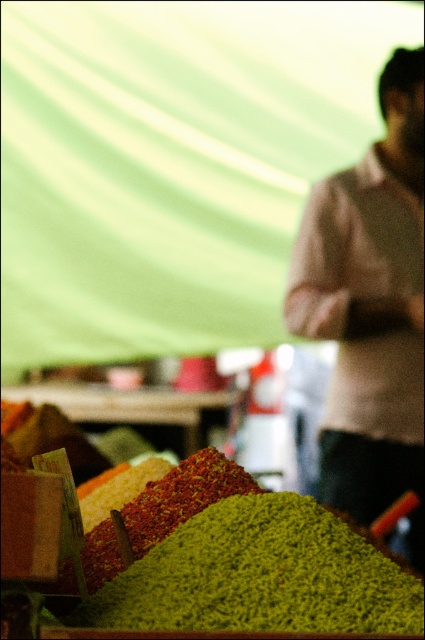
Looking at this image, between light brown sweater at right and green granular spice at center, which one appears on the right side from the viewer's perspective?

Positioned to the right is light brown sweater at right.

Measure the distance between point (x=354, y=193) and camera.

Point (x=354, y=193) and camera are 8.18 feet apart from each other.

Does point (393, 452) come closer to viewer compared to point (130, 605)?

No, it is behind (130, 605).

Locate an element on the screen. light brown sweater at right is located at coordinates pos(371,308).

Who is higher up, light brown sweater at right or green granular spices at center?

Positioned higher is light brown sweater at right.

Does point (326, 304) lie in front of point (192, 513)?

No, it is behind (192, 513).

Who is more distant from viewer, [357,198] or [161,508]?

The point [357,198] is more distant.

At what (x,y) coordinates should I click in order to perform the action: click on light brown sweater at right. Please return your answer as a coordinate pair (x, y). This screenshot has height=640, width=425. Looking at the image, I should click on (371, 308).

Who is positioned more to the right, green granular spice at center or green granular spices at center?

Positioned to the right is green granular spice at center.

Looking at this image, can you confirm if green granular spice at center is wider than green granular spices at center?

Correct, the width of green granular spice at center exceeds that of green granular spices at center.

Where is `green granular spice at center`? The height and width of the screenshot is (640, 425). green granular spice at center is located at coordinates (260, 576).